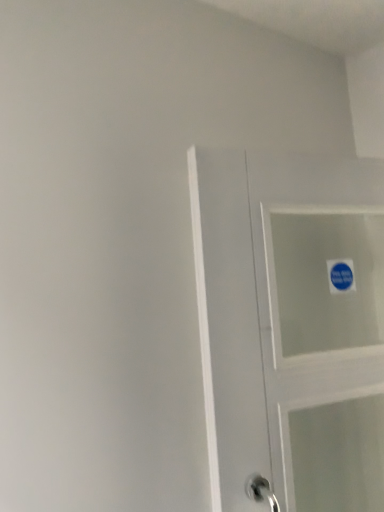
Question: Is blue paper sticker at upper right bigger than white glossy door at center?

Choices:
 (A) yes
 (B) no

Answer: (B)

Question: Is white glossy door at center a part of blue paper sticker at upper right?

Choices:
 (A) yes
 (B) no

Answer: (B)

Question: Considering the relative sizes of blue paper sticker at upper right and white glossy door at center in the image provided, is blue paper sticker at upper right smaller than white glossy door at center?

Choices:
 (A) yes
 (B) no

Answer: (A)

Question: Does blue paper sticker at upper right lie in front of white glossy door at center?

Choices:
 (A) no
 (B) yes

Answer: (A)

Question: From a real-world perspective, does blue paper sticker at upper right stand above white glossy door at center?

Choices:
 (A) yes
 (B) no

Answer: (A)

Question: Is blue paper sticker at upper right positioned with its back to white glossy door at center?

Choices:
 (A) yes
 (B) no

Answer: (A)

Question: Would you say white glossy door at center is outside blue paper sticker at upper right?

Choices:
 (A) no
 (B) yes

Answer: (B)

Question: Does white glossy door at center touch blue paper sticker at upper right?

Choices:
 (A) no
 (B) yes

Answer: (A)

Question: Is white glossy door at center oriented towards blue paper sticker at upper right?

Choices:
 (A) no
 (B) yes

Answer: (B)

Question: From a real-world perspective, is white glossy door at center physically below blue paper sticker at upper right?

Choices:
 (A) yes
 (B) no

Answer: (A)

Question: Can you confirm if white glossy door at center is taller than blue paper sticker at upper right?

Choices:
 (A) no
 (B) yes

Answer: (B)

Question: From the image's perspective, would you say white glossy door at center is shown under blue paper sticker at upper right?

Choices:
 (A) yes
 (B) no

Answer: (A)

Question: Is white glossy door at center taller or shorter than blue paper sticker at upper right?

Choices:
 (A) tall
 (B) short

Answer: (A)